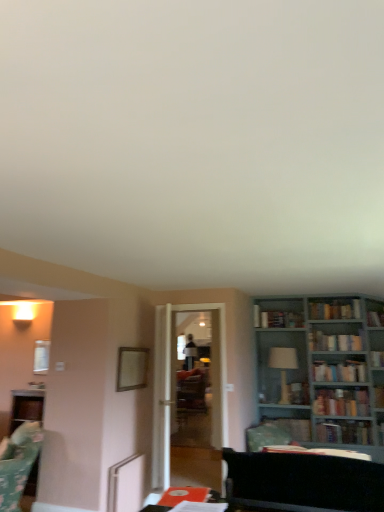
Question: Would you say teal wooden bookcase at right is to the left or to the right of green fabric swivel chair at lower left in the picture?

Choices:
 (A) right
 (B) left

Answer: (A)

Question: Do you think teal wooden bookcase at right is within green fabric swivel chair at lower left, or outside of it?

Choices:
 (A) inside
 (B) outside

Answer: (B)

Question: Considering the real-world distances, which object is closest to the black fabric futon at lower right?

Choices:
 (A) wooden picture frame at upper center
 (B) matte orange book at lower center, the eighth book viewed from the back
 (C) teal wooden bookcase at right
 (D) hardcover book at right, which is counted as the fifth book, starting from the back
 (E) hardcover book at center, the 3th book positioned from the back

Answer: (B)

Question: Considering the real-world distances, which object is closest to the hardcover book at right, arranged as the 2th book when viewed from the front?

Choices:
 (A) transparent glass door at center
 (B) hardcover book at center, which appears as the 6th book when viewed from the front
 (C) white glossy lampshade at center-right
 (D) hardcover book at upper center, acting as the 4th book starting from the back
 (E) matte orange book at lower center, the eighth book viewed from the back

Answer: (B)